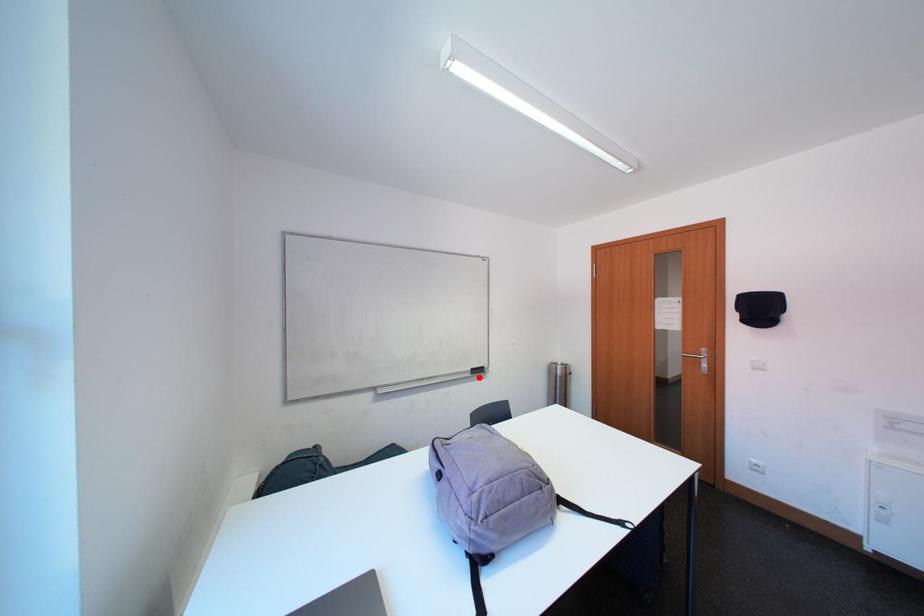
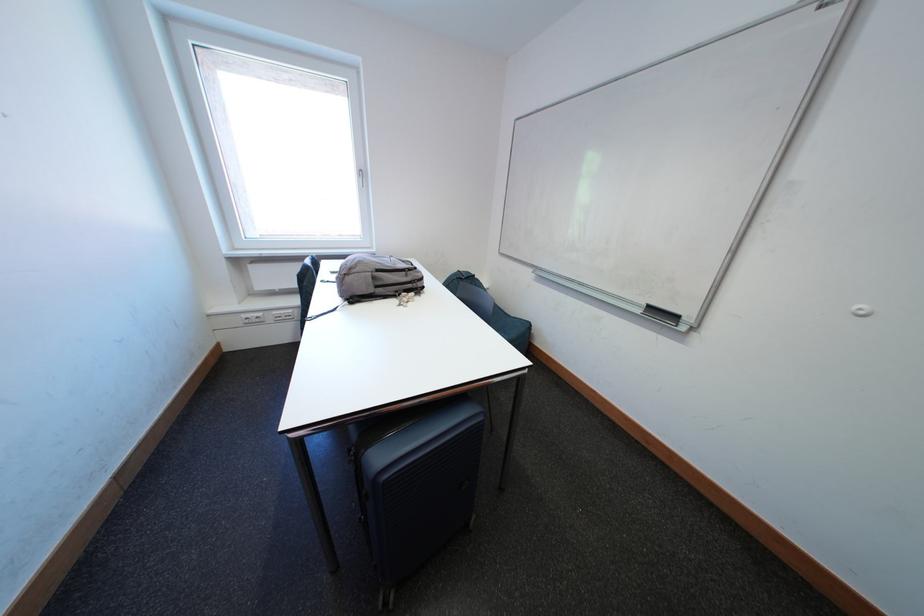
Question: I am providing you with two images of the same scene from different viewpoints. In image1, a red point is highlighted. Considering the same 3D point in image2, which of the following is correct?

Choices:
 (A) It is closer
 (B) It is farther

Answer: (A)